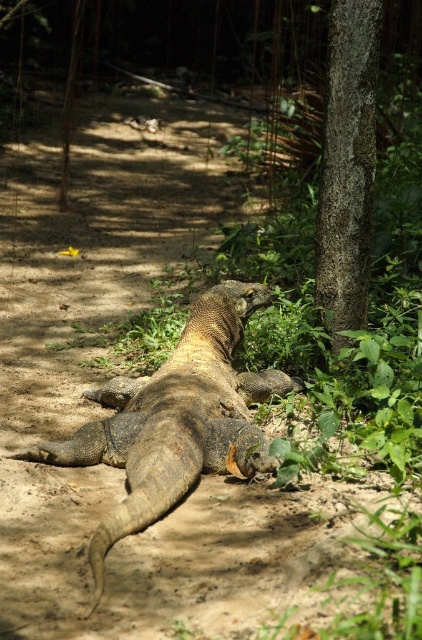
Which is more to the right, leathery brown lizard at center or smooth bark tree trunk at right?

Positioned to the right is smooth bark tree trunk at right.

Does leathery brown lizard at center have a lesser width compared to smooth bark tree trunk at right?

No.

Is point (194, 436) positioned after point (343, 195)?

No, it is not.

Locate an element on the screen. The width and height of the screenshot is (422, 640). leathery brown lizard at center is located at coordinates (175, 420).